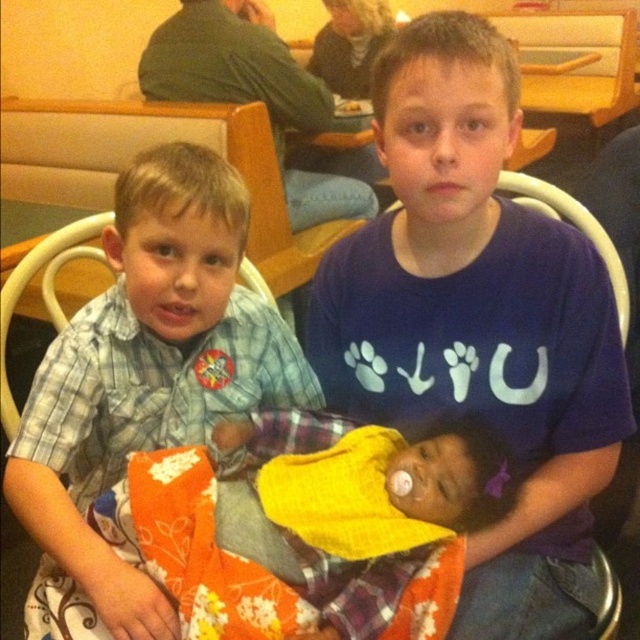
You are a photographer adjusting your camera to focus on two points in the image. The first point is point (x=483, y=563) and the second is point (x=321, y=493). Which point is closer to the camera?

Point (x=483, y=563) is further to the camera than point (x=321, y=493), so the second point is closer to the camera.

You are a photographer setting up for a group photo. You notice the blue cotton shirt at center and the orange floral fabric at center. Which item is covering the other?

The blue cotton shirt at center is positioned over orange floral fabric at center, so the blue cotton shirt is covering the orange floral fabric.